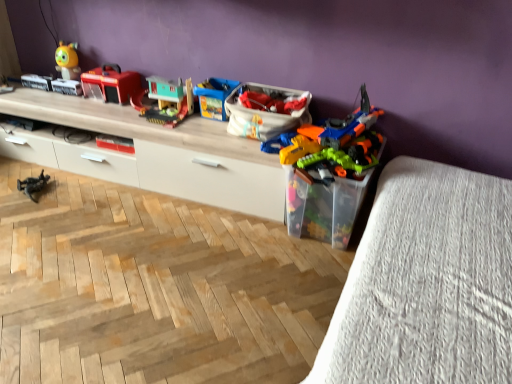
This screenshot has height=384, width=512. What are the coordinates of `free point below metallic gray toy soldier at lower left, marked as the 1th toy in a left-to-right arrangement (from a real-world perspective)` in the screenshot? It's located at (39, 189).